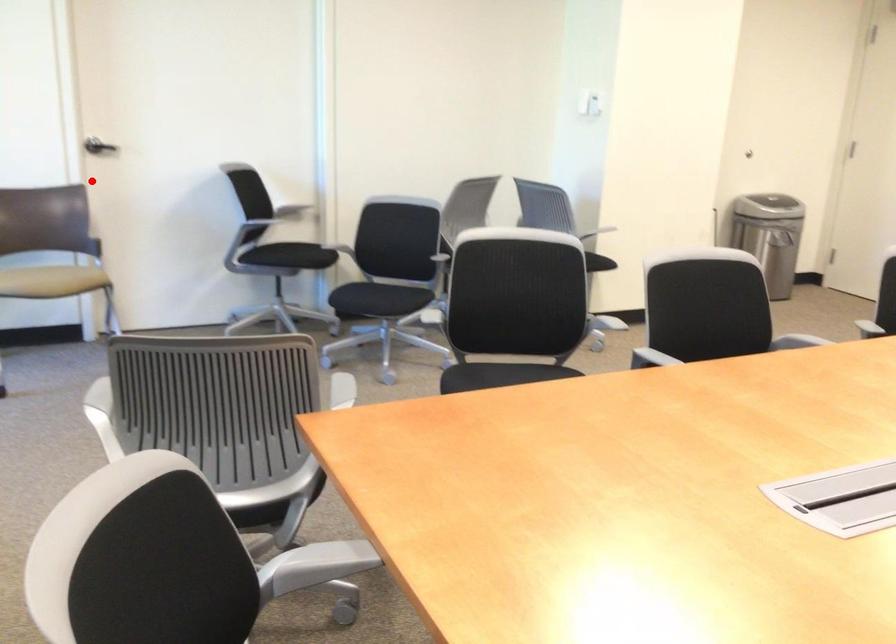
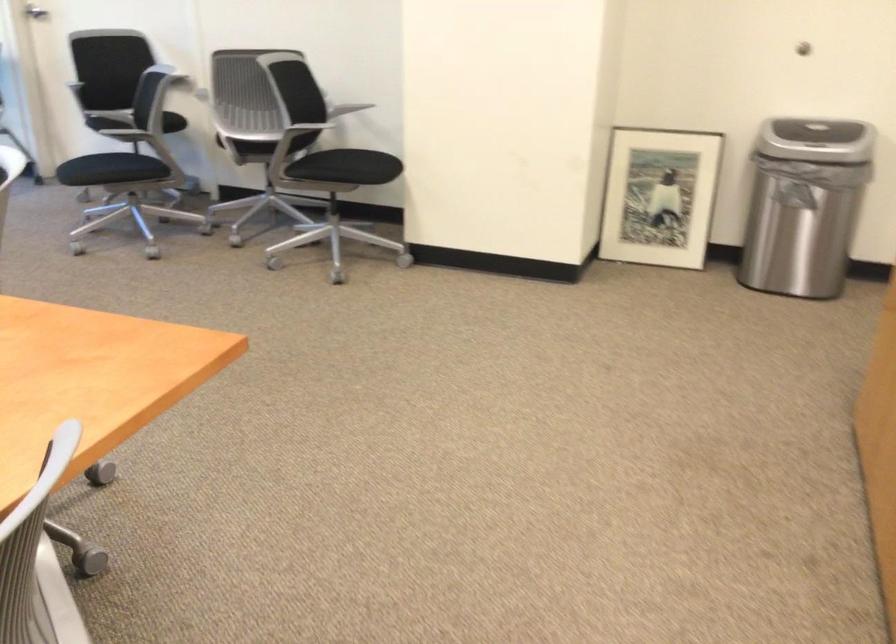
Find the pixel in the second image that matches the highlighted location in the first image.

(36, 12)